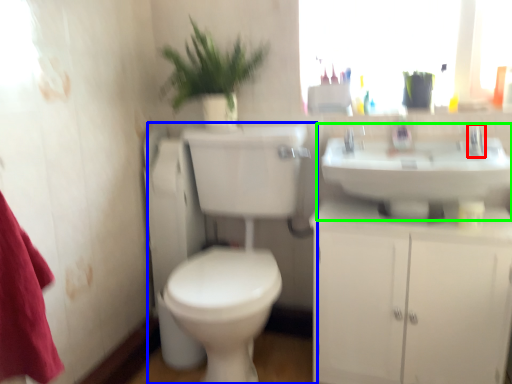
Question: Estimate the real-world distances between objects in this image. Which object is farther from tap (highlighted by a red box), toilet (highlighted by a blue box) or sink (highlighted by a green box)?

Choices:
 (A) toilet
 (B) sink

Answer: (A)